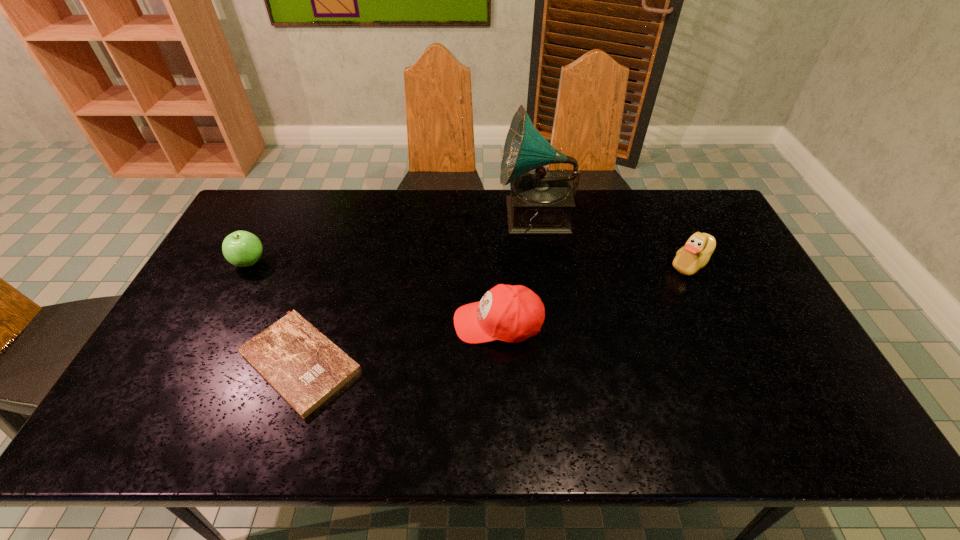
At what (x,y) coordinates should I click in order to perform the action: click on object at the left edge. Please return your answer as a coordinate pair (x, y). Looking at the image, I should click on (241, 248).

Find the location of a particular element. This screenshot has width=960, height=540. object that is positioned at the right edge is located at coordinates 696,253.

The width and height of the screenshot is (960, 540). Identify the location of free space at the far edge of the desktop. (613, 189).

Locate an element on the screen. The image size is (960, 540). vacant space at the near edge is located at coordinates (367, 410).

You are a GUI agent. You are given a task and a screenshot of the screen. Output one action in this format:
    pyautogui.click(x=<x>, y=<y>)
    Task: Click on the free space at the left edge of the desktop
    
    Given the screenshot: What is the action you would take?
    195,298

Where is `vacant space at the right edge of the desktop`? The height and width of the screenshot is (540, 960). vacant space at the right edge of the desktop is located at coordinates (736, 284).

The width and height of the screenshot is (960, 540). Find the location of `vacant region at the far right corner of the desktop`. vacant region at the far right corner of the desktop is located at coordinates (688, 225).

Where is `free point between the farthest object and the leftmost object`? This screenshot has width=960, height=540. free point between the farthest object and the leftmost object is located at coordinates (393, 240).

You are a GUI agent. You are given a task and a screenshot of the screen. Output one action in this format:
    pyautogui.click(x=<x>, y=<y>)
    Task: Click on the free point between the apple and the duck
    Image resolution: width=960 pixels, height=540 pixels.
    Given the screenshot: What is the action you would take?
    pyautogui.click(x=469, y=262)

This screenshot has height=540, width=960. I want to click on blank region between the leftmost object and the Bible, so click(x=275, y=312).